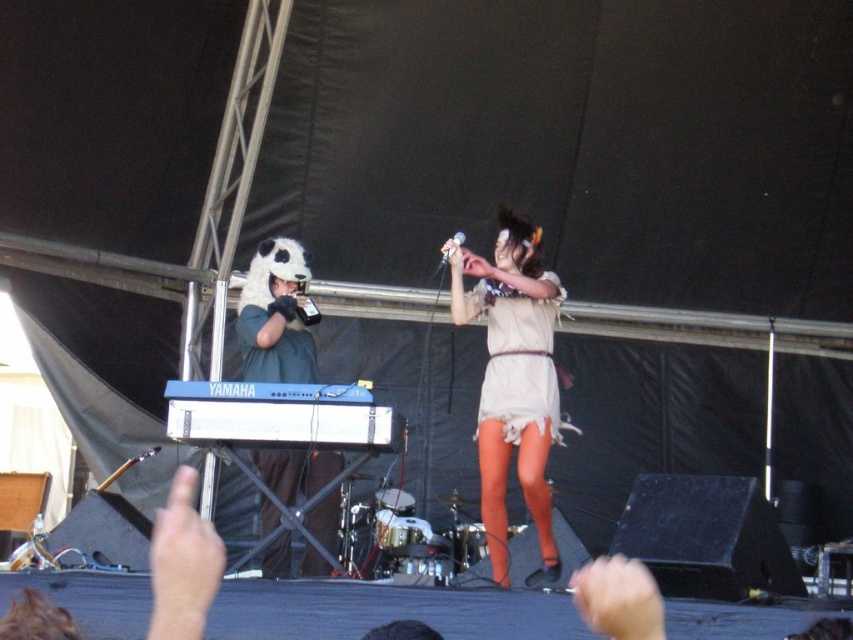
Consider the image. Can you confirm if white plastic keyboard at center is positioned to the left of beige fabric dress at center?

Correct, you'll find white plastic keyboard at center to the left of beige fabric dress at center.

Locate an element on the screen. The height and width of the screenshot is (640, 853). white plastic keyboard at center is located at coordinates (281, 417).

Can you confirm if light beige fabric dress at center is wider than beige fabric dress at center?

Indeed, light beige fabric dress at center has a greater width compared to beige fabric dress at center.

Can you confirm if light beige fabric dress at center is positioned to the left of beige fabric dress at center?

Yes, light beige fabric dress at center is to the left of beige fabric dress at center.

Find the location of `light beige fabric dress at center`. light beige fabric dress at center is located at coordinates (514, 380).

Does light beige fabric dress at center come in front of white plastic keyboard at center?

No.

Who is more forward, (503,451) or (183,394)?

Positioned in front is point (183,394).

Find the location of a particular element. The width and height of the screenshot is (853, 640). light beige fabric dress at center is located at coordinates (514, 380).